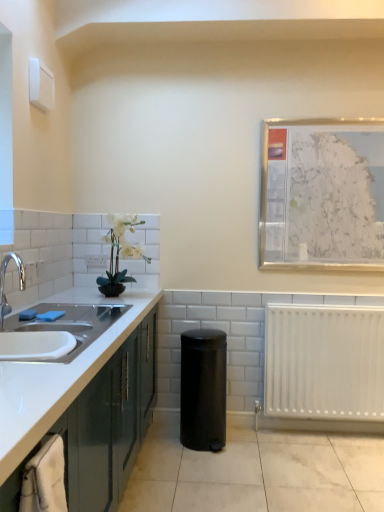
Locate an element on the screen. free space in front of black matte trash can at center is located at coordinates (210, 466).